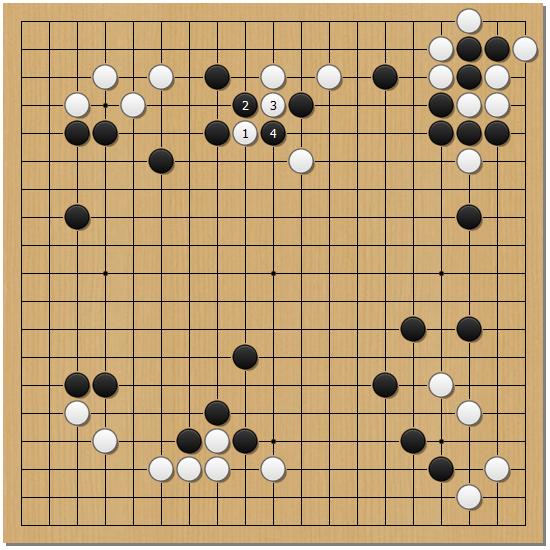
Locate an element on the screen. visible black circles on the game board is located at coordinates (273, 441), (441, 441), (440, 271), (272, 273), (104, 272), (104, 104).